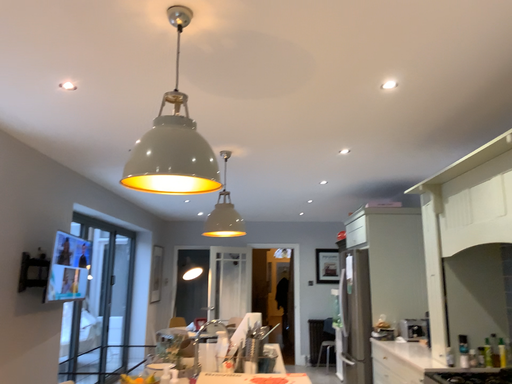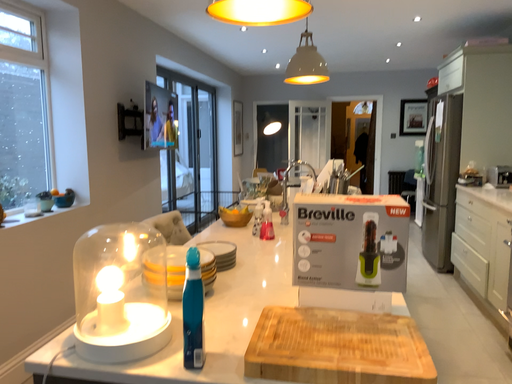
Question: How did the camera likely rotate when shooting the video?

Choices:
 (A) rotated right
 (B) rotated left

Answer: (B)